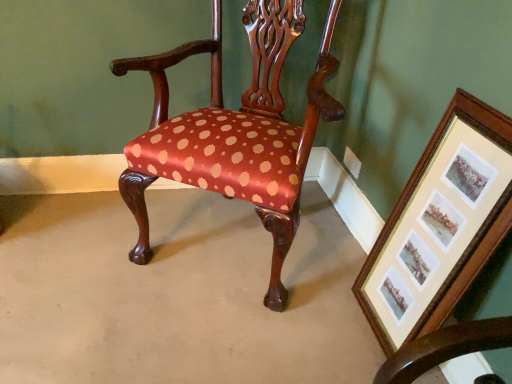
At what (x,y) coordinates should I click in order to perform the action: click on vacant space in front of satin fabric chair at center. Please return your answer as a coordinate pair (x, y). This screenshot has height=384, width=512. Looking at the image, I should click on (203, 334).